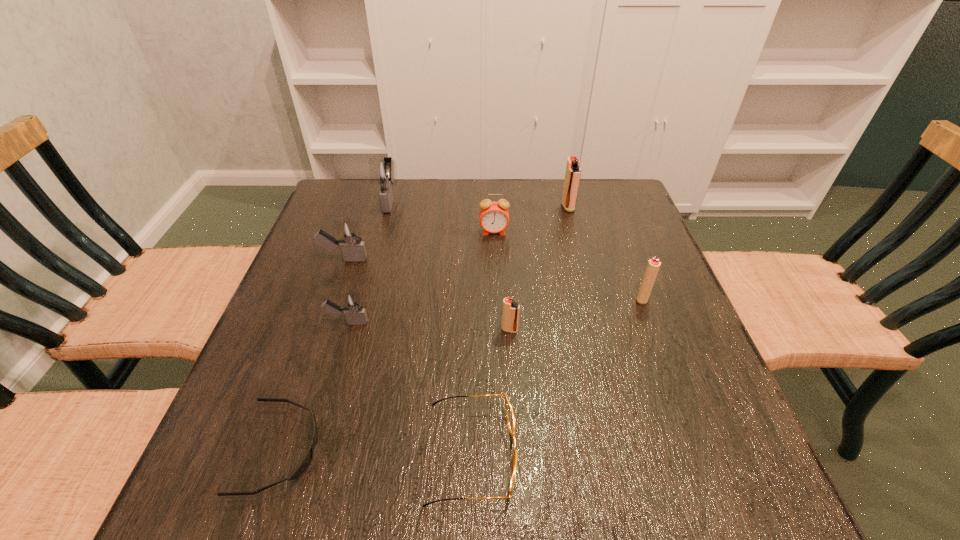
You are a GUI agent. You are given a task and a screenshot of the screen. Output one action in this format:
    pyautogui.click(x=<x>, y=<y>)
    Task: Click on the red igniter that is the nearest to the leftmost red igniter
    This screenshot has height=540, width=960.
    Given the screenshot: What is the action you would take?
    pyautogui.click(x=653, y=266)

Point out which gray igniter is positioned as the third nearest to the rightmost red igniter. Please provide its 2D coordinates. Your answer should be formatted as a tuple, i.e. [(x, y)], where the tuple contains the x and y coordinates of a point satisfying the conditions above.

[(382, 171)]

Identify which gray igniter is the nearest to the fourth nearest igniter. Please provide its 2D coordinates. Your answer should be formatted as a tuple, i.e. [(x, y)], where the tuple contains the x and y coordinates of a point satisfying the conditions above.

[(352, 306)]

This screenshot has height=540, width=960. Identify the location of free space that satisfies the following two spatial constraints: 1. on the back side of the biggest red igniter; 2. on the left side of the smallest gray igniter. tap(381, 207).